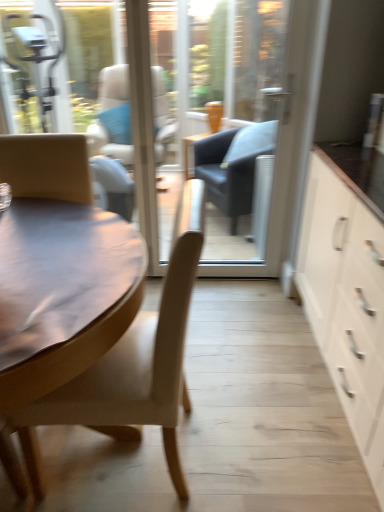
Question: Can you confirm if matte brown chair at left is thinner than white matte cabinet at right?

Choices:
 (A) yes
 (B) no

Answer: (B)

Question: Is matte brown chair at left next to white matte cabinet at right and touching it?

Choices:
 (A) no
 (B) yes

Answer: (A)

Question: Is matte brown chair at left smaller than white matte cabinet at right?

Choices:
 (A) yes
 (B) no

Answer: (A)

Question: Does matte brown chair at left come behind white matte cabinet at right?

Choices:
 (A) yes
 (B) no

Answer: (A)

Question: Is matte brown chair at left far from white matte cabinet at right?

Choices:
 (A) no
 (B) yes

Answer: (A)

Question: Is matte brown chair at left shorter than white matte cabinet at right?

Choices:
 (A) no
 (B) yes

Answer: (B)

Question: Is white matte cabinet at right facing away from transparent glass door at center?

Choices:
 (A) yes
 (B) no

Answer: (B)

Question: Could transparent glass door at center be considered to be inside white matte cabinet at right?

Choices:
 (A) no
 (B) yes

Answer: (A)

Question: Considering the relative sizes of white matte cabinet at right and transparent glass door at center in the image provided, is white matte cabinet at right thinner than transparent glass door at center?

Choices:
 (A) yes
 (B) no

Answer: (B)

Question: From a real-world perspective, is white matte cabinet at right below transparent glass door at center?

Choices:
 (A) no
 (B) yes

Answer: (B)

Question: Considering the relative sizes of white matte cabinet at right and transparent glass door at center in the image provided, is white matte cabinet at right shorter than transparent glass door at center?

Choices:
 (A) no
 (B) yes

Answer: (B)

Question: From the image's perspective, is white matte cabinet at right on top of transparent glass door at center?

Choices:
 (A) yes
 (B) no

Answer: (B)

Question: Does transparent glass door at center have a greater width compared to matte brown chair at left?

Choices:
 (A) yes
 (B) no

Answer: (B)